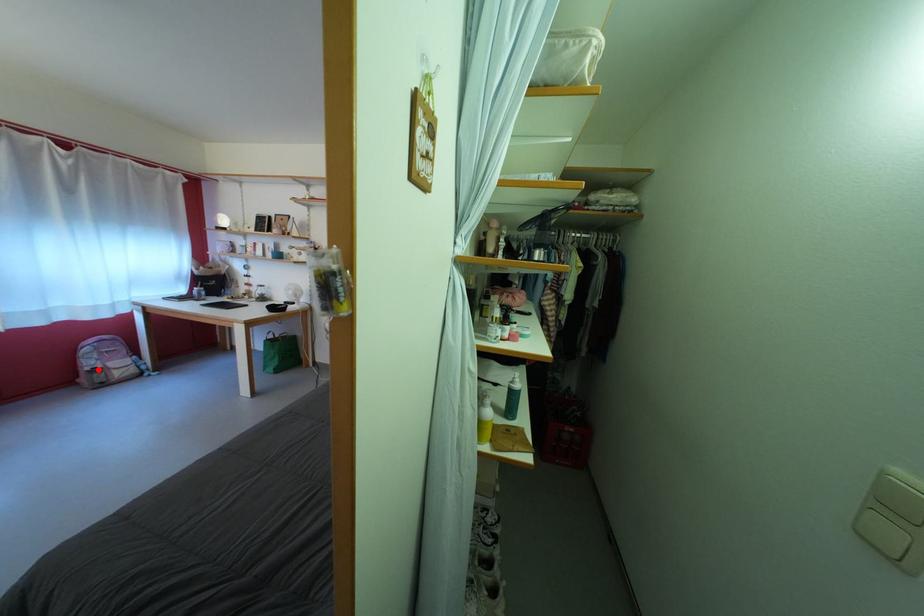
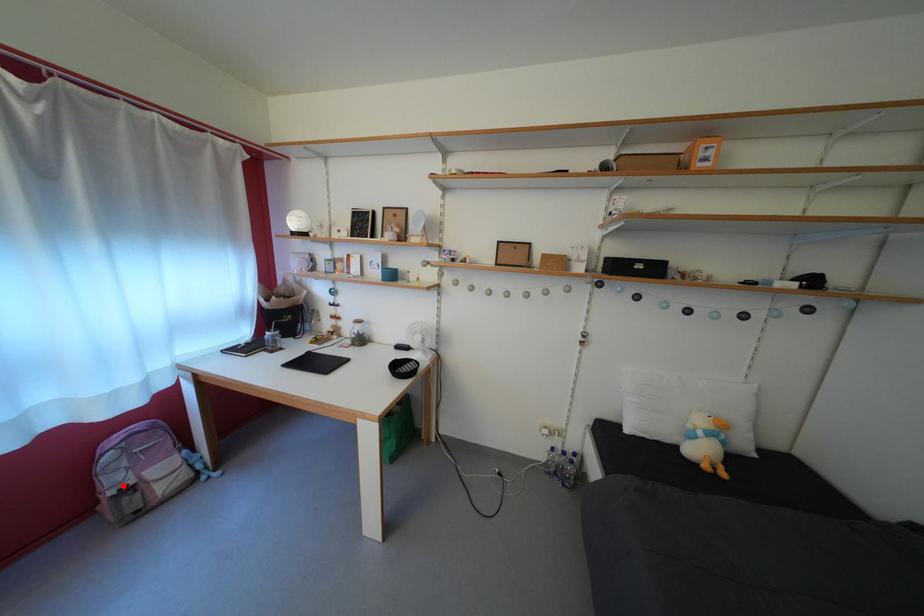
I am providing you with two images of the same scene from different viewpoints. A red point is marked on the first image and another point is marked on the second image. Does the point marked in image1 correspond to the same location as the one in image2?

Yes